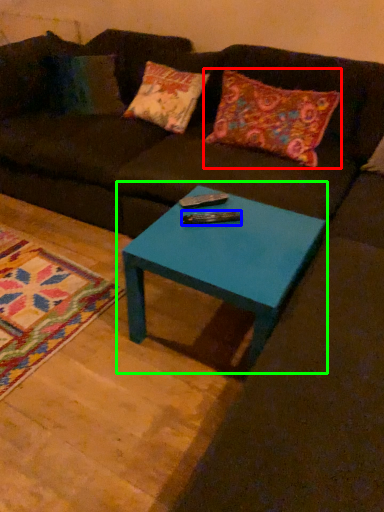
Question: Based on their relative distances, which object is farther from pillow (highlighted by a red box)? Choose from remote (highlighted by a blue box) and coffee table (highlighted by a green box).

Choices:
 (A) remote
 (B) coffee table

Answer: (A)